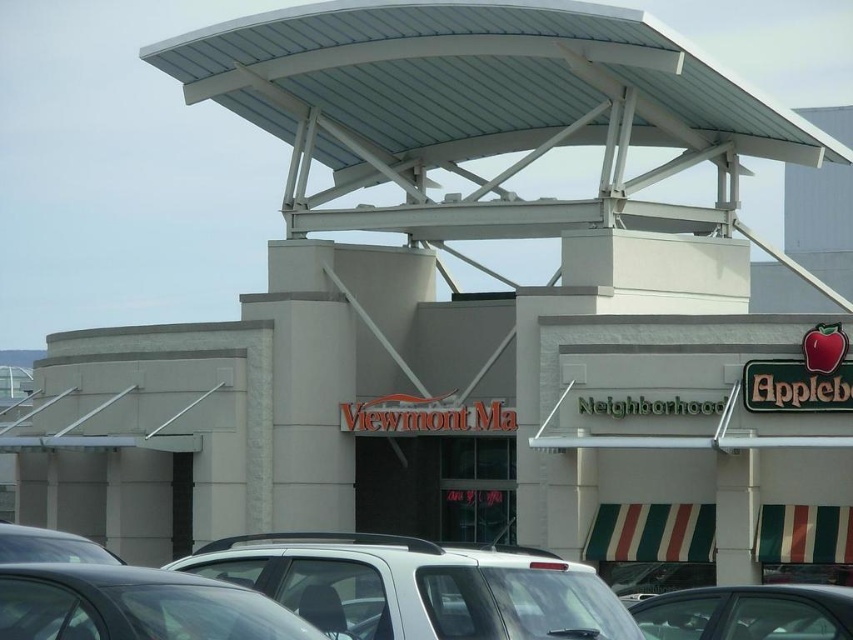
You are a delivery driver who needs to park your 3.5 meter long truck in the parking lot near the Viewmont Ma building. There is a white matte suv at center and a shiny black car at lower left. Can your truck fit between them without touching either vehicle?

The distance between the white matte suv at center and the shiny black car at lower left is 4.34 meters. Since the truck is 3.5 meters long, there is enough space for it to fit between them without touching either vehicle.

You are a delivery driver arriving at the Viewmont Ma building. Your GPS shows your current location as point 0.5, 0.5. The white matte suv at center is blocking the entrance. Can you estimate if you can safely navigate around it to reach the entrance?

The white matte suv at center is located at point (416, 586). Since your GPS shows you are at point (426, 320), you are closer to the entrance than the SUV. You can safely navigate around the SUV by moving to the left or right side of it to reach the entrance.